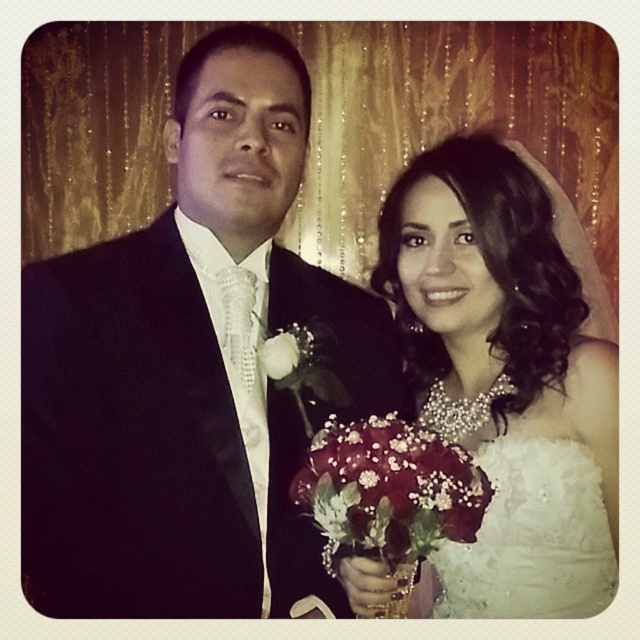
Question: In this image, where is black satin tuxedo at left located relative to white silk rose at center?

Choices:
 (A) below
 (B) above

Answer: (A)

Question: Which point is closer to the camera?

Choices:
 (A) black satin tuxedo at left
 (B) velvety red roses at center
 (C) white silk rose at center
 (D) white satin dress at center

Answer: (B)

Question: Is black satin tuxedo at left smaller than velvety red roses at center?

Choices:
 (A) no
 (B) yes

Answer: (A)

Question: Among these objects, which one is nearest to the camera?

Choices:
 (A) velvety red roses at center
 (B) black satin tuxedo at left
 (C) white satin dress at center

Answer: (A)

Question: Estimate the real-world distances between objects in this image. Which object is closer to the white lace dress at lower right?

Choices:
 (A) velvety red roses at center
 (B) white silk rose at center
 (C) white satin dress at center
 (D) black satin tuxedo at left

Answer: (C)

Question: Can you confirm if black satin tuxedo at left is positioned above white satin dress at center?

Choices:
 (A) no
 (B) yes

Answer: (B)